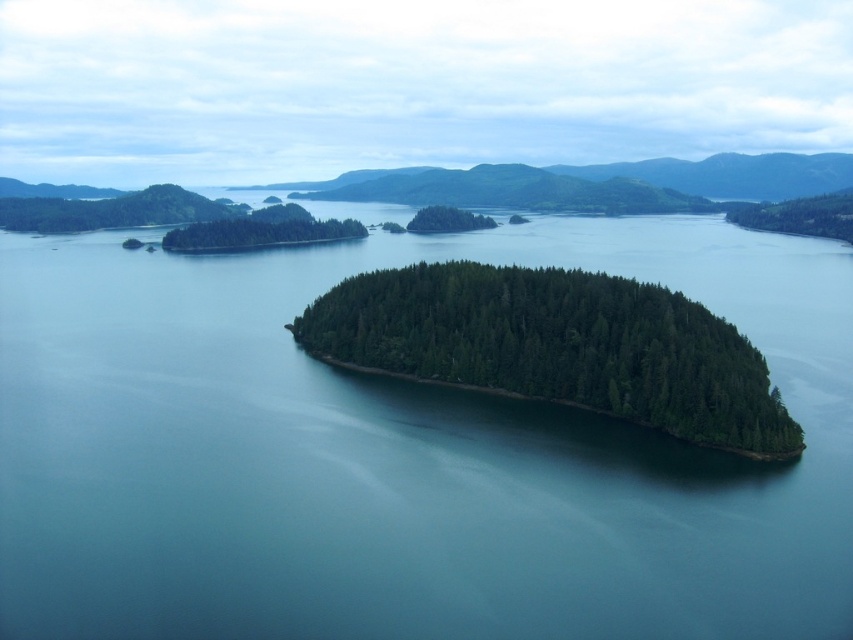
You are a bird soaring above the islands and want to land on either the green matte tree at upper left or the green matte forest at right. Which location would allow you to land safely without hitting any obstacles, considering their heights?

The green matte tree at upper left has a lesser height compared to the green matte forest at right, so landing on the green matte tree at upper left would be safer as it has less obstruction.

You are a bird soaring above the islands. You see the green matte forest at upper left and the green matte tree at center. Which one would you prefer to land on if you want a larger area to rest?

The green matte forest at upper left is larger in size than the green matte tree at center, so the bird should choose the green matte forest at upper left to land for a larger resting area.